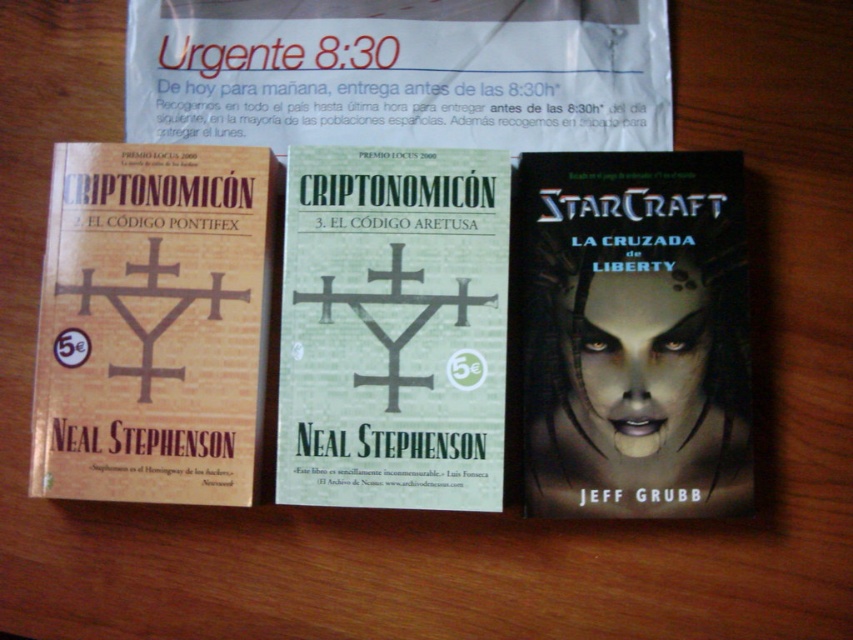
Is green matte book at center smaller than matte paper book at left?

Yes, green matte book at center is smaller than matte paper book at left.

This screenshot has height=640, width=853. I want to click on green matte book at center, so click(393, 328).

Does matte paper book at left have a larger size compared to matte paper flyer at center?

Correct, matte paper book at left is larger in size than matte paper flyer at center.

Who is positioned more to the right, matte paper book at left or matte paper flyer at center?

From the viewer's perspective, matte paper flyer at center appears more on the right side.

Between point (190, 496) and point (564, 58), which one is positioned behind?

Positioned behind is point (564, 58).

What are the coordinates of `matte paper book at left` in the screenshot? It's located at (152, 324).

Which is more to the left, dark matte cover at center or matte paper flyer at center?

matte paper flyer at center is more to the left.

Which is above, dark matte cover at center or matte paper flyer at center?

matte paper flyer at center

Is point (660, 356) positioned behind point (560, 76)?

No, it is in front of (560, 76).

At what (x,y) coordinates should I click in order to perform the action: click on dark matte cover at center. Please return your answer as a coordinate pair (x, y). The height and width of the screenshot is (640, 853). Looking at the image, I should click on (634, 333).